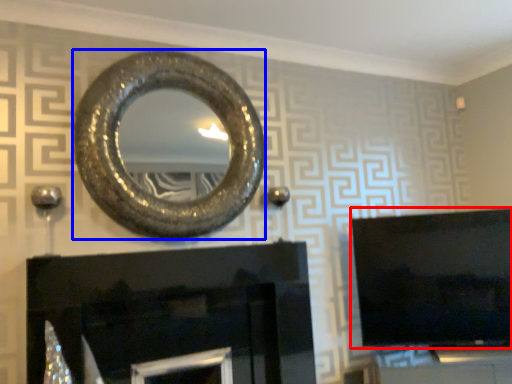
Question: Which of the following is the farthest to the observer, television (highlighted by a red box) or oval (highlighted by a blue box)?

Choices:
 (A) television
 (B) oval

Answer: (A)